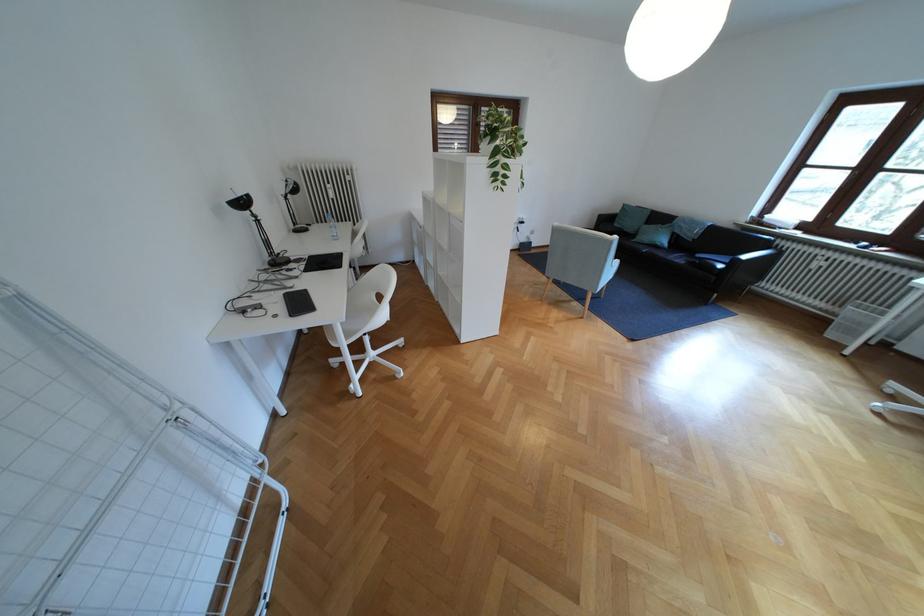
Describe the element at coordinates (240, 203) in the screenshot. I see `the black lamp head` at that location.